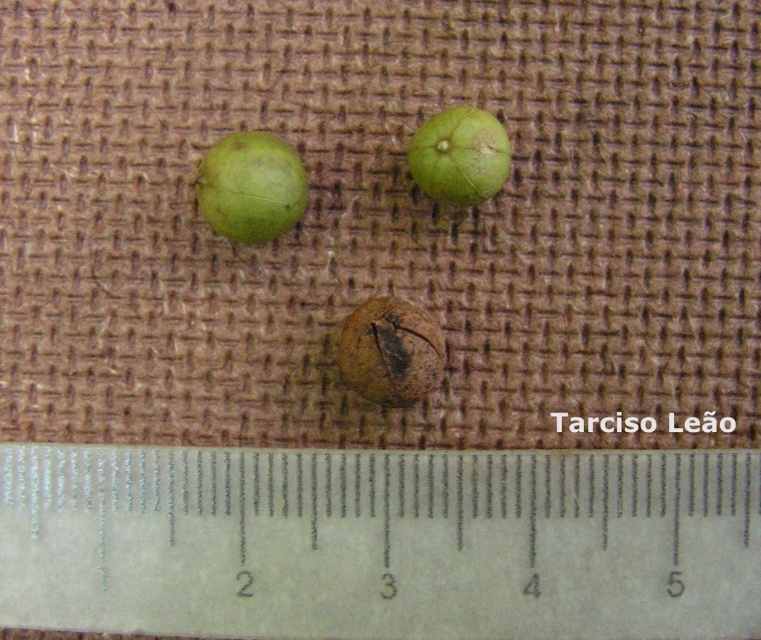
Question: Which point is closer to the camera?

Choices:
 (A) brown rough seed at center
 (B) green matte seed at upper center
 (C) green matte sphere at upper left

Answer: (A)

Question: Which object is farther from the camera taking this photo?

Choices:
 (A) brown rough seed at center
 (B) white plastic ruler at center
 (C) green matte sphere at upper left
 (D) green matte seed at upper center

Answer: (D)

Question: Estimate the real-world distances between objects in this image. Which object is closer to the white plastic ruler at center?

Choices:
 (A) green matte seed at upper center
 (B) brown rough seed at center
 (C) green matte sphere at upper left

Answer: (B)

Question: From the image, what is the correct spatial relationship of brown rough seed at center in relation to green matte seed at upper center?

Choices:
 (A) left
 (B) right

Answer: (A)

Question: In this image, where is white plastic ruler at center located relative to green matte seed at upper center?

Choices:
 (A) right
 (B) left

Answer: (B)

Question: Can you confirm if green matte sphere at upper left is smaller than green matte seed at upper center?

Choices:
 (A) yes
 (B) no

Answer: (B)